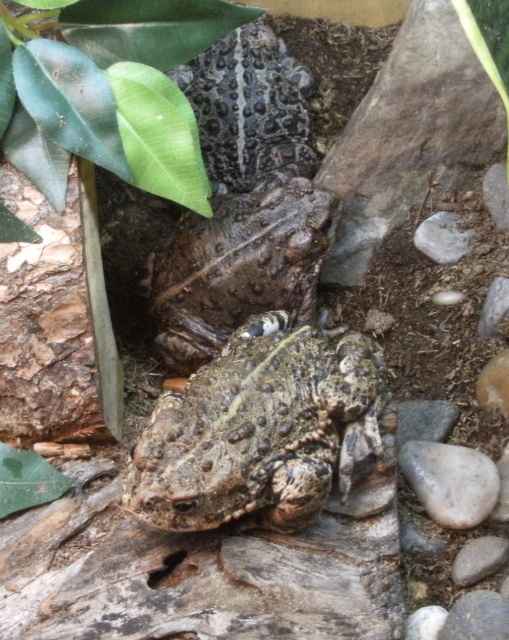
Can you confirm if speckled brown frog at center is shorter than spotted brown skin at center?

Yes.

Describe the element at coordinates (261, 429) in the screenshot. I see `speckled brown frog at center` at that location.

Where is `speckled brown frog at center`? The width and height of the screenshot is (509, 640). speckled brown frog at center is located at coordinates (261, 429).

Locate an element on the screen. This screenshot has width=509, height=640. speckled brown frog at center is located at coordinates (261, 429).

Is point (210, 218) positioned behind point (264, 33)?

No.

Does spotted brown skin at center have a lesser height compared to speckled rough skin at center?

Indeed, spotted brown skin at center has a lesser height compared to speckled rough skin at center.

The height and width of the screenshot is (640, 509). What are the coordinates of `spotted brown skin at center` in the screenshot? It's located at (237, 268).

Between green matte leaf at upper left and white smooth rock at right, which one has more height?

With more height is green matte leaf at upper left.

Between green matte leaf at upper left and white smooth rock at right, which one has less height?

white smooth rock at right

Between point (29, 61) and point (446, 483), which one is positioned behind?

Point (446, 483)

This screenshot has width=509, height=640. I want to click on green matte leaf at upper left, so click(108, 90).